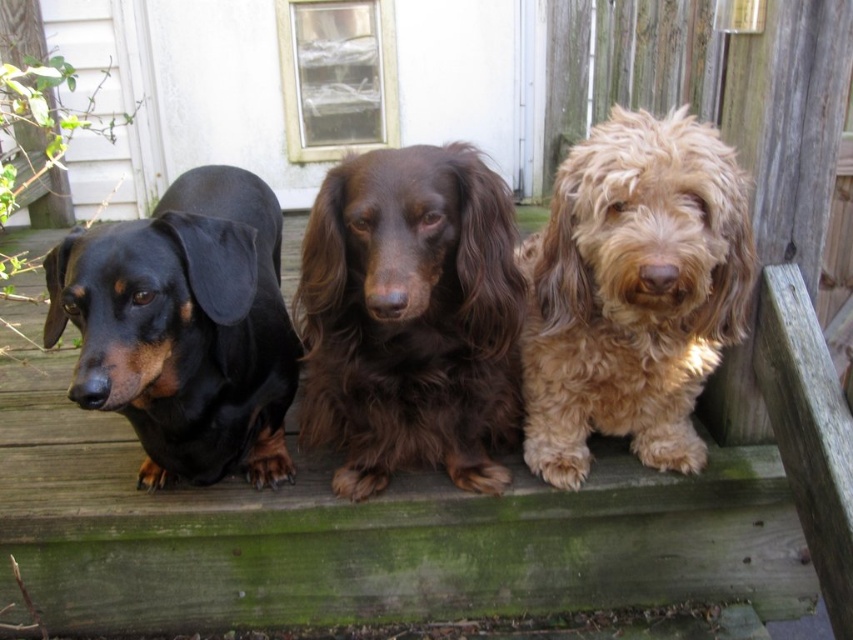
You are a dog owner who wants to buy a new collar for your dogs. The black shiny coat at left is 20 inches tall, and the fuzzy golden dog at center is 15 inches tall. Which dog requires a smaller collar?

The fuzzy golden dog at center requires a smaller collar since it is 15 inches tall, which is smaller than the black shiny coat at left that is 20 inches tall.

You are standing on the wooden deck with three dogs. You want to place a treat exactly at the point marked by coordinates point (410, 317). Which dog should you target to ensure the treat lands near them?

The point (410, 317) corresponds to the brown shaggy dog at center, so you should target that dog to ensure the treat lands near them.

In the scene shown: You are standing on the wooden deck and want to pet the brown shaggy dog at center and the black shiny coat at left. Which dog should you approach first if you want to reach the one that is higher up?

The brown shaggy dog at center is located above the black shiny coat at left, so you should approach the brown shaggy dog at center first since it is higher up.